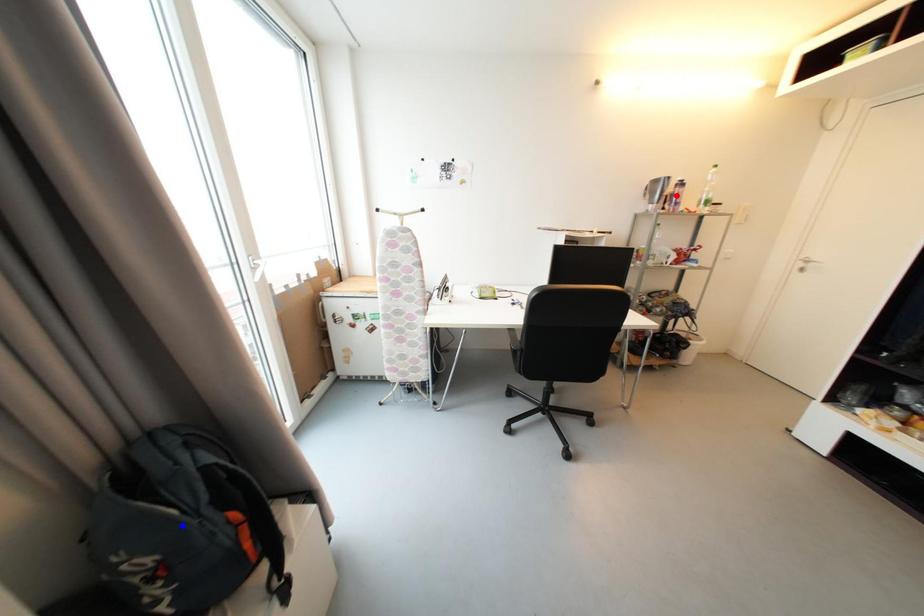
Question: In the image, two points are highlighted. Which point is nearer to the camera? Reply with the corresponding letter.

Choices:
 (A) blue point
 (B) red point

Answer: (A)